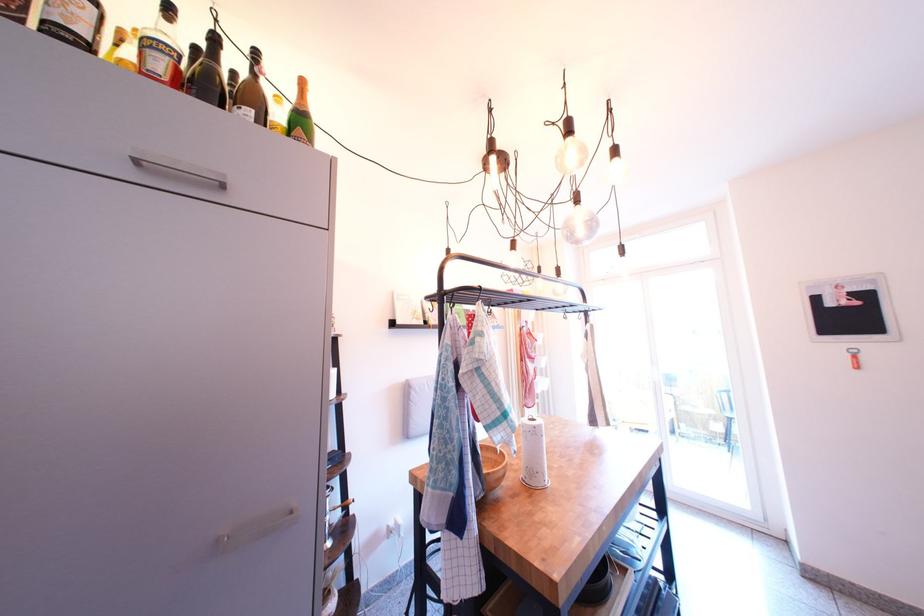
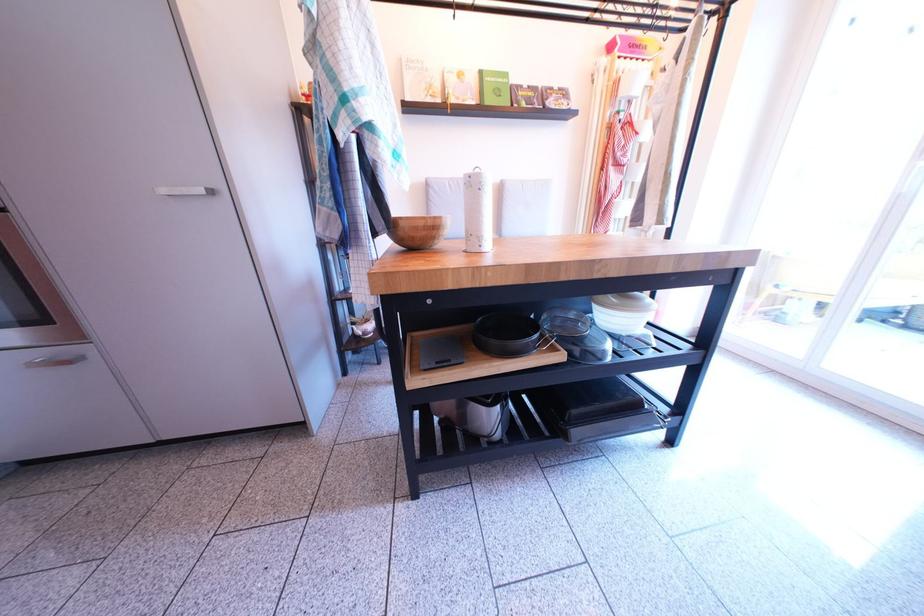
The images are taken continuously from a first-person perspective. In which direction is your viewpoint rotating?

The rotation direction of the camera is left-down.